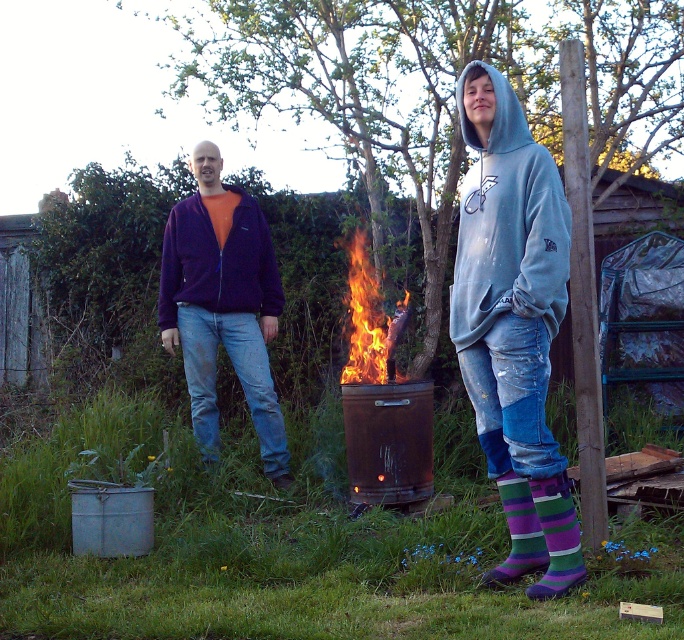
Question: Which of the following is the closest to the observer?

Choices:
 (A) (233, 307)
 (B) (503, 237)
 (C) (345, 381)

Answer: (B)

Question: Can you confirm if purple fleece jacket at center is positioned above purple striped socks at lower right?

Choices:
 (A) yes
 (B) no

Answer: (A)

Question: Which point is farther from the camera taking this photo?

Choices:
 (A) (166, 284)
 (B) (534, 509)
 (C) (527, 168)
 (D) (553, 579)

Answer: (A)

Question: Among these objects, which one is farthest from the camera?

Choices:
 (A) flaming wood at center
 (B) purple striped sock at lower right
 (C) purple fleece jacket at center

Answer: (C)

Question: Is flaming wood at center further to camera compared to purple striped socks at lower right?

Choices:
 (A) no
 (B) yes

Answer: (B)

Question: Does flaming wood at center appear over purple striped socks at lower right?

Choices:
 (A) yes
 (B) no

Answer: (A)